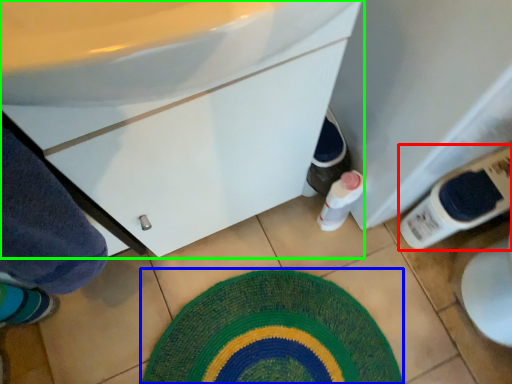
Question: Considering the real-world distances, which object is farthest from bottle (highlighted by a red box)? bath mat (highlighted by a blue box) or bathroom cabinet (highlighted by a green box)?

Choices:
 (A) bath mat
 (B) bathroom cabinet

Answer: (B)